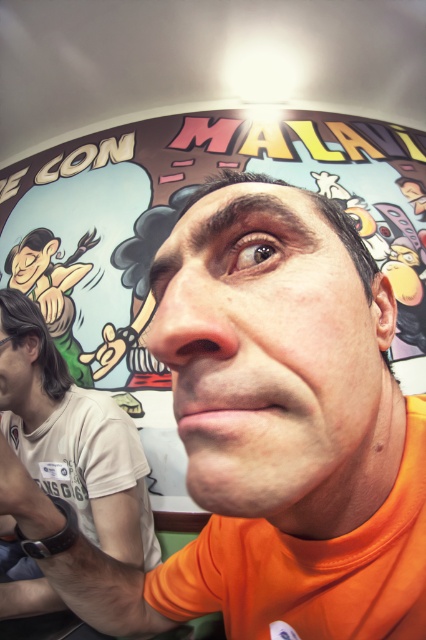
Question: Can you confirm if orange matte face at center is positioned to the right of white t-shirt at left?

Choices:
 (A) no
 (B) yes

Answer: (B)

Question: Is pink matte lips at center bigger than matte black hair at left?

Choices:
 (A) yes
 (B) no

Answer: (B)

Question: Which object is the farthest from the orange matte face at center?

Choices:
 (A) pink matte lips at center
 (B) matte green face at upper left
 (C) orange matte shirt at center

Answer: (B)

Question: Among these points, which one is nearest to the camera?

Choices:
 (A) (40, 378)
 (B) (233, 412)
 (C) (34, 385)

Answer: (B)

Question: Can you confirm if orange matte shirt at center is smaller than matte green face at upper left?

Choices:
 (A) no
 (B) yes

Answer: (A)

Question: Among these points, which one is farthest from the camera?

Choices:
 (A) (17, 356)
 (B) (192, 241)
 (C) (106, 536)
 (D) (244, 428)

Answer: (A)